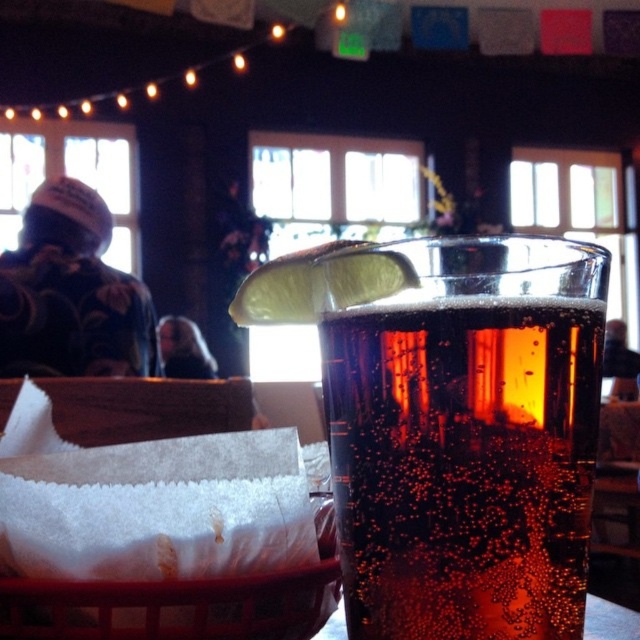
Locate an element on the screen. wooden basket at lower left is located at coordinates (172, 605).

Who is positioned more to the left, wooden basket at lower left or dark hair at center?

dark hair at center is more to the left.

Identify the location of wooden basket at lower left. This screenshot has width=640, height=640. (172, 605).

This screenshot has height=640, width=640. In order to click on wooden basket at lower left in this screenshot , I will do `click(172, 605)`.

Does wooden basket at lower left come in front of matte black jacket at upper left?

Yes, it is.

Is point (193, 628) positioned in front of point (609, 330)?

No, (193, 628) is behind (609, 330).

Locate an element on the screen. Image resolution: width=640 pixels, height=640 pixels. wooden basket at lower left is located at coordinates (172, 605).

Between point (122, 330) and point (81, 611), which one is positioned behind?

Positioned behind is point (122, 330).

Can you confirm if flannel shirt at left is thinner than wooden basket at lower left?

In fact, flannel shirt at left might be wider than wooden basket at lower left.

Who is more forward, [93,266] or [92,589]?

Point [92,589] is more forward.

The height and width of the screenshot is (640, 640). In order to click on flannel shirt at left in this screenshot , I will do `click(72, 292)`.